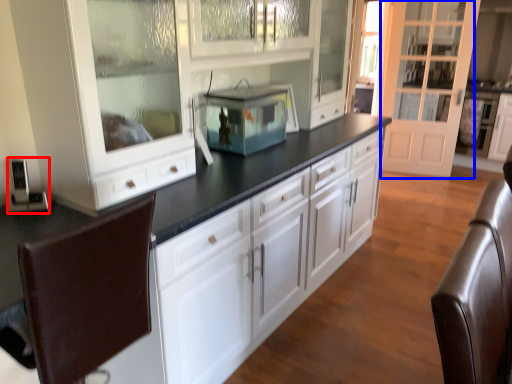
Question: Which object is closer to the camera taking this photo, appliance (highlighted by a red box) or glass door (highlighted by a blue box)?

Choices:
 (A) appliance
 (B) glass door

Answer: (A)